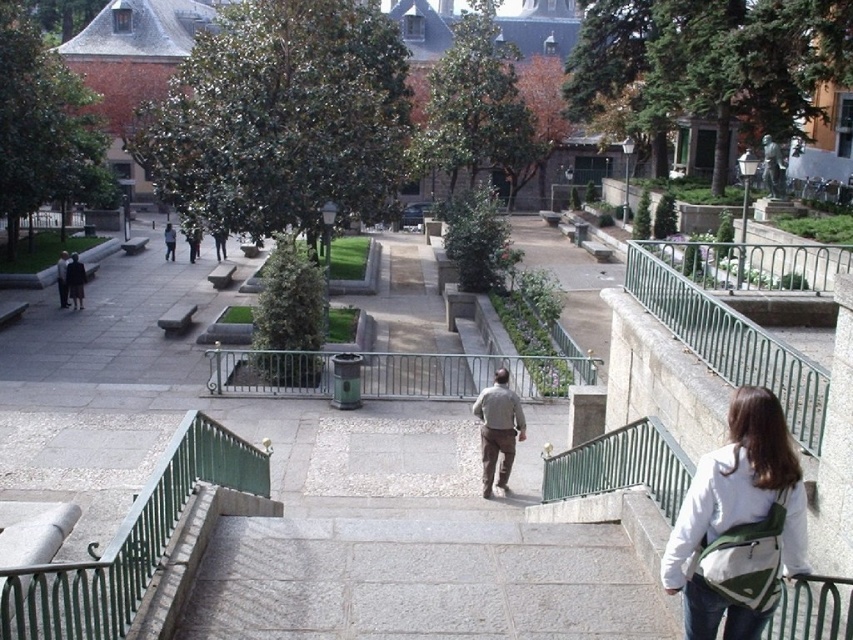
You are a photographer trying to capture both the white fabric backpack at right and the green metal railing at lower left in the same frame. Given their sizes, which object should you focus on first to ensure both are clearly visible in your photo?

Since the white fabric backpack at right is smaller than the green metal railing at lower left, you should focus on the white fabric backpack at right first to ensure its details are sharp while the larger railing will remain in focus more easily.

You are a photographer trying to capture a photo of the dark gray wool coat at left without including the green metal railing at upper right in the frame. Based on their sizes, is this possible?

The green metal railing at upper right is bigger than the dark gray wool coat at left, so it might be challenging to exclude the railing from the photo if the coat is positioned in a way that the larger railing is within the same frame. Adjusting the camera angle or moving closer to the coat could help isolate it.